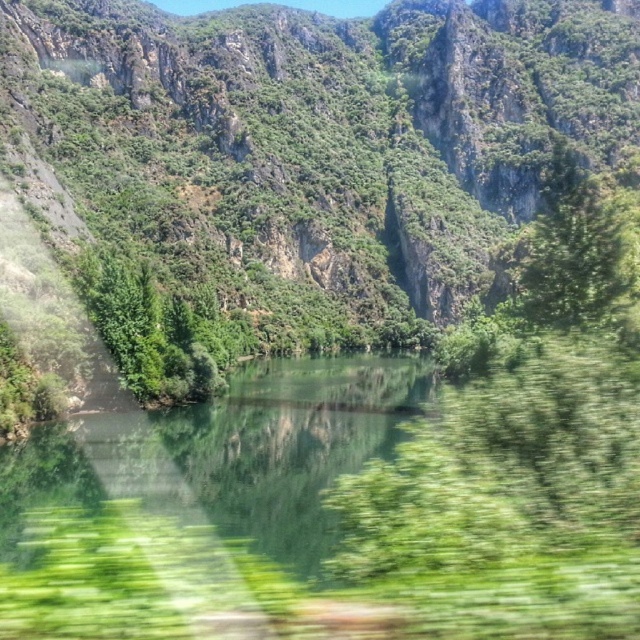
You are standing at the edge of the water in the scene and want to know if the green rocky mountain at center is wider than the green leafy tree at upper right. Can you determine this based on the available information?

The green rocky mountain at center might be wider than green leafy tree at upper right according to the description.